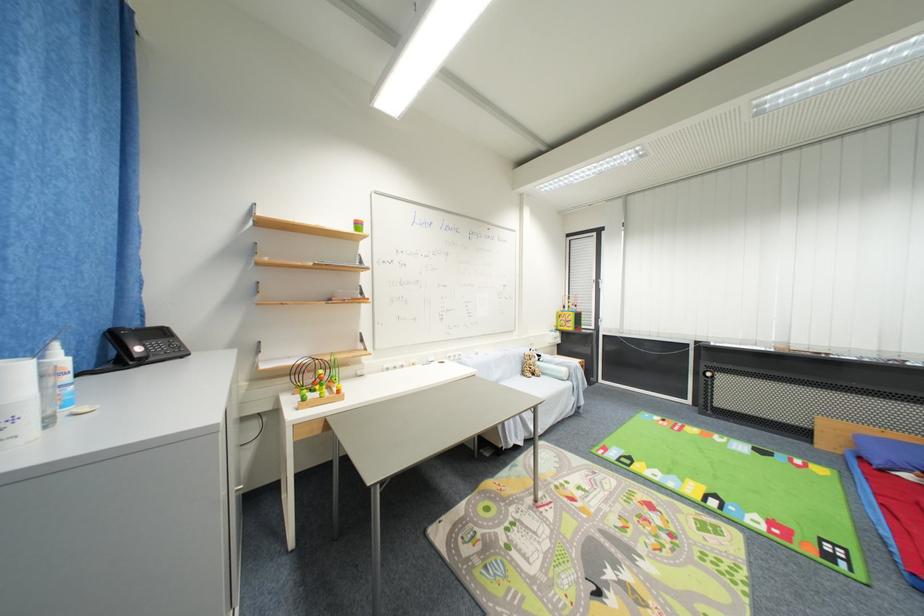
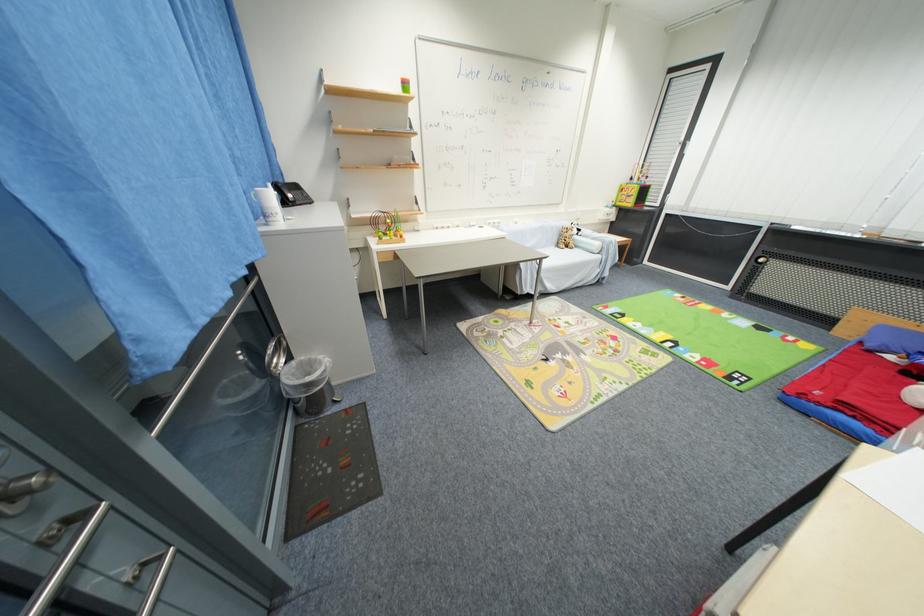
In the second image, find the point that corresponds to pixel 309 402 in the first image.

(385, 241)